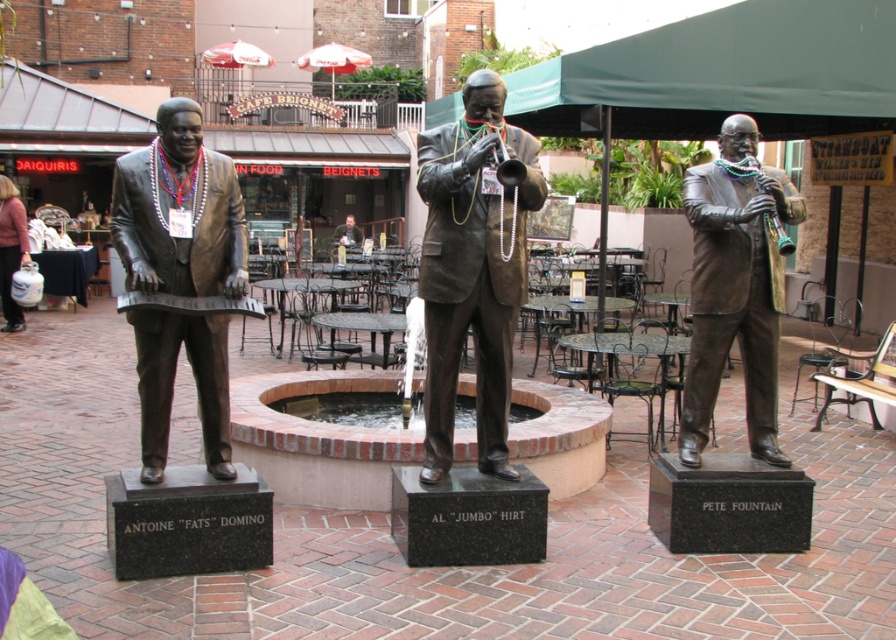
Which of these two, bronze statue of man playing clarinet at center or brushed metal water at bottle left, stands taller?

bronze statue of man playing clarinet at center

The width and height of the screenshot is (896, 640). Identify the location of bronze statue of man playing clarinet at center. (735, 285).

Is point (742, 301) more distant than point (22, 244)?

No, it is not.

What are the coordinates of `bronze statue of man playing clarinet at center` in the screenshot? It's located at (735, 285).

Who is more distant from viewer, (514, 84) or (22, 221)?

The point (22, 221) is behind.

Is point (700, 92) closer to camera compared to point (0, 280)?

That is True.

Find the location of a particular element. The height and width of the screenshot is (640, 896). green fabric canopy at upper center is located at coordinates (726, 74).

Which of these two, green fabric canopy at upper center or bronze statue of man playing clarinet at center, stands shorter?

With less height is green fabric canopy at upper center.

Is point (668, 61) positioned in front of point (709, 212)?

No, (668, 61) is behind (709, 212).

Locate an element on the screen. Image resolution: width=896 pixels, height=640 pixels. green fabric canopy at upper center is located at coordinates (726, 74).

Identify the location of green fabric canopy at upper center. (726, 74).